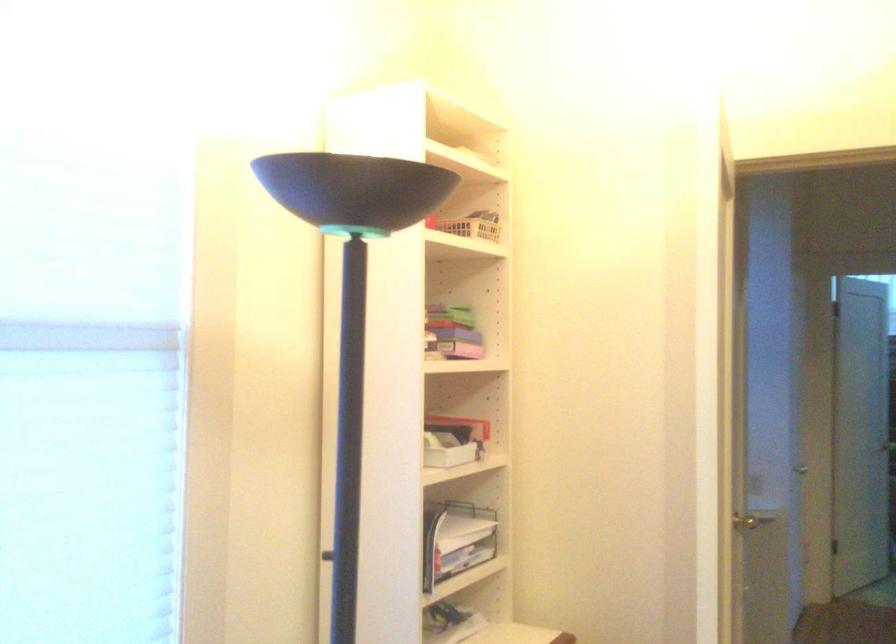
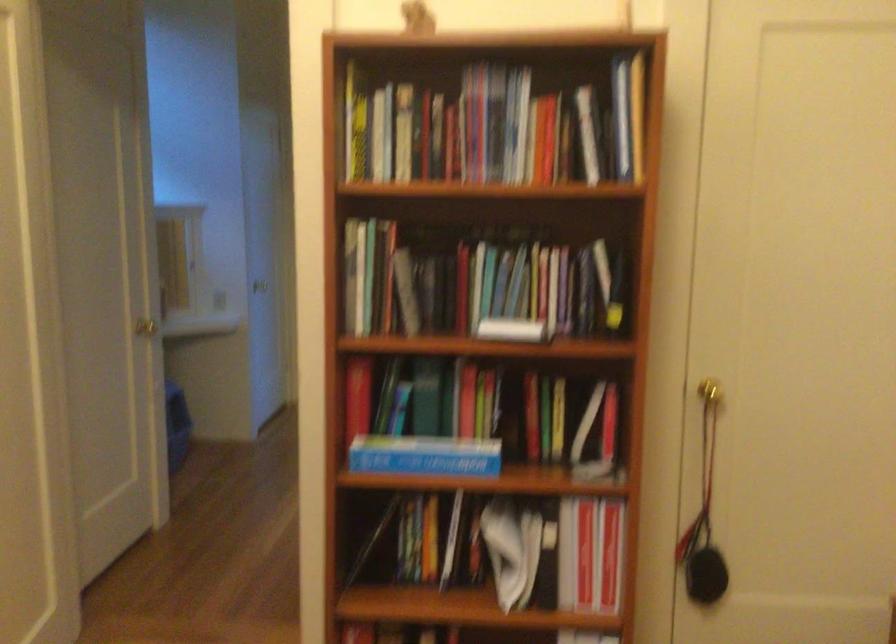
Question: The camera is either moving clockwise (left) or counter-clockwise (right) around the object. The first image is from the beginning of the video and the second image is from the end. Is the camera moving left or right when shooting the video?

Choices:
 (A) Left
 (B) Right

Answer: (A)